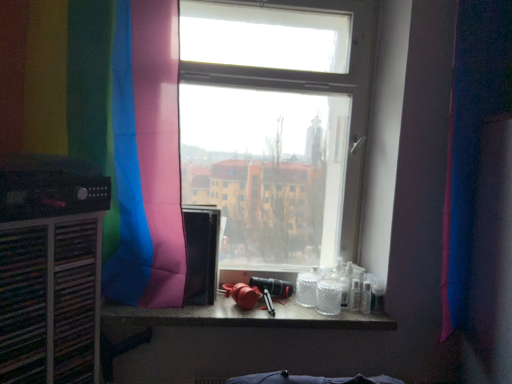
Question: Is black matte speaker at left located outside translucent glass counter top at center?

Choices:
 (A) yes
 (B) no

Answer: (A)

Question: Could translucent glass counter top at center be considered to be inside black matte speaker at left?

Choices:
 (A) yes
 (B) no

Answer: (B)

Question: Is black matte speaker at left far away from translucent glass counter top at center?

Choices:
 (A) yes
 (B) no

Answer: (B)

Question: Does black matte speaker at left have a greater height compared to translucent glass counter top at center?

Choices:
 (A) no
 (B) yes

Answer: (B)

Question: From the image's perspective, does black matte speaker at left appear lower than translucent glass counter top at center?

Choices:
 (A) yes
 (B) no

Answer: (B)

Question: Based on their sizes in the image, would you say translucent glass counter top at center is bigger or smaller than pink fabric curtain at right, the second curtain from the left?

Choices:
 (A) small
 (B) big

Answer: (A)

Question: Looking at their shapes, would you say translucent glass counter top at center is wider or thinner than pink fabric curtain at right, the 1th curtain in the right-to-left sequence?

Choices:
 (A) thin
 (B) wide

Answer: (B)

Question: From a real-world perspective, is translucent glass counter top at center positioned above or below pink fabric curtain at right, the second curtain from the left?

Choices:
 (A) above
 (B) below

Answer: (B)

Question: Based on their positions, is translucent glass counter top at center located to the left or right of pink fabric curtain at right, the second curtain from the left?

Choices:
 (A) right
 (B) left

Answer: (B)

Question: Considering their positions, is black matte speaker at left located in front of or behind pink fabric curtain at right, the 1th curtain in the right-to-left sequence?

Choices:
 (A) front
 (B) behind

Answer: (A)

Question: In terms of width, does black matte speaker at left look wider or thinner when compared to pink fabric curtain at right, the second curtain from the left?

Choices:
 (A) wide
 (B) thin

Answer: (A)

Question: Is black matte speaker at left taller or shorter than pink fabric curtain at right, the second curtain from the left?

Choices:
 (A) short
 (B) tall

Answer: (A)

Question: Based on their positions, is black matte speaker at left located to the left or right of pink fabric curtain at right, the 1th curtain in the right-to-left sequence?

Choices:
 (A) left
 (B) right

Answer: (A)

Question: Is point (155, 311) closer or farther from the camera than point (32, 216)?

Choices:
 (A) farther
 (B) closer

Answer: (A)

Question: In the image, is translucent glass counter top at center positioned in front of or behind black matte speaker at left?

Choices:
 (A) front
 (B) behind

Answer: (B)